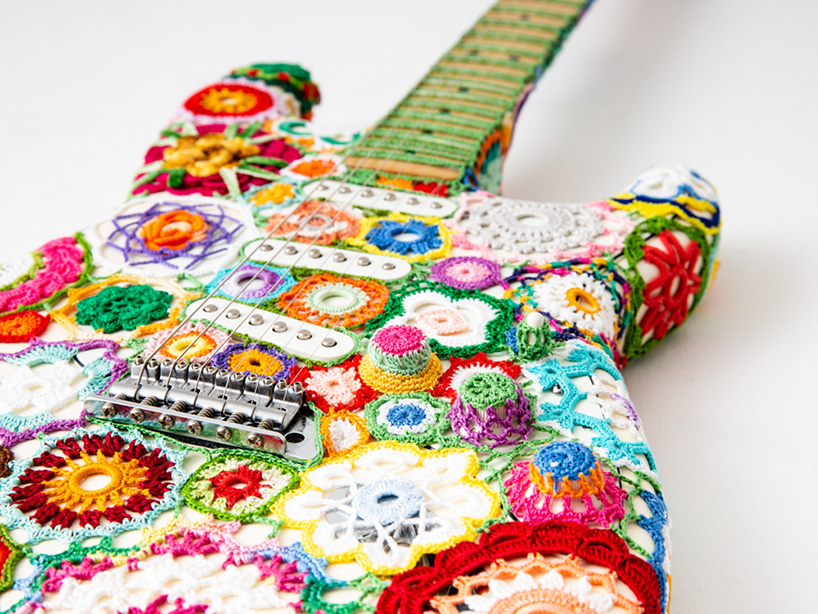
Where is `handle`? handle is located at coordinates (524, 41).